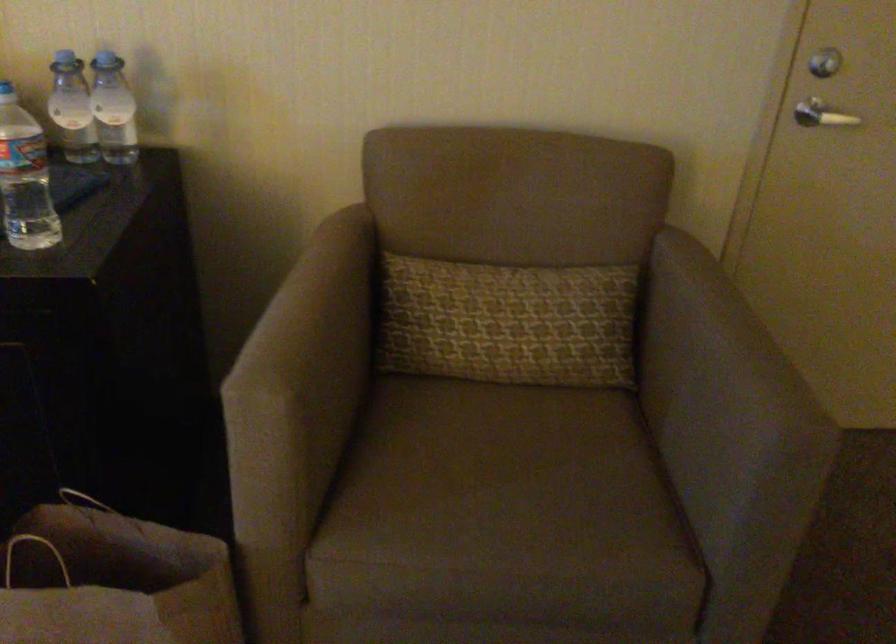
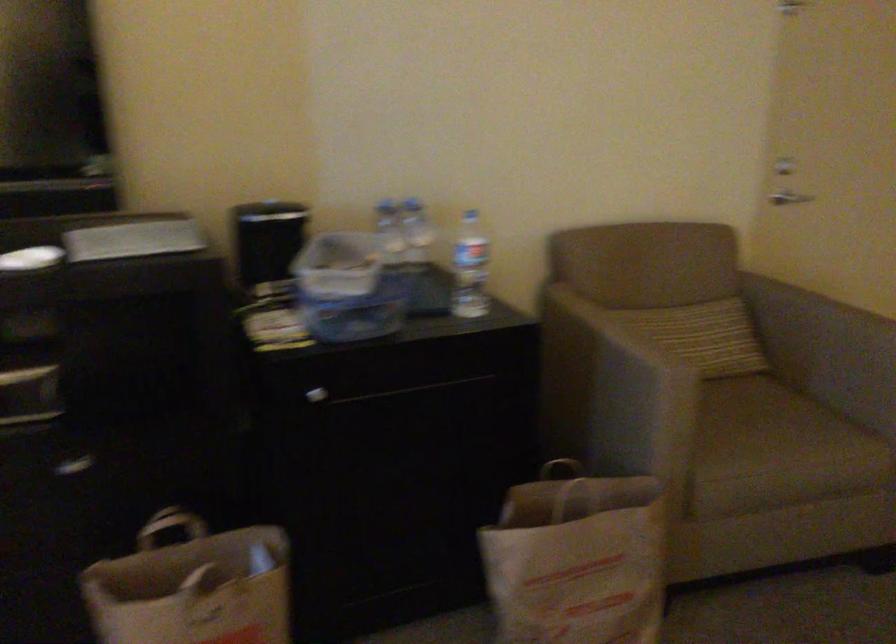
Locate, in the second image, the point that corresponds to [156,532] in the first image.

(576, 493)